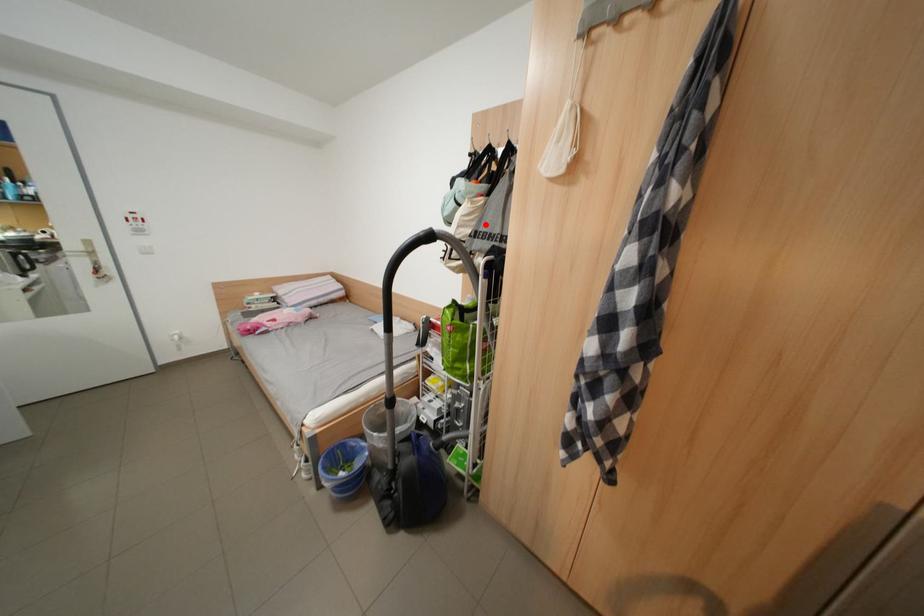
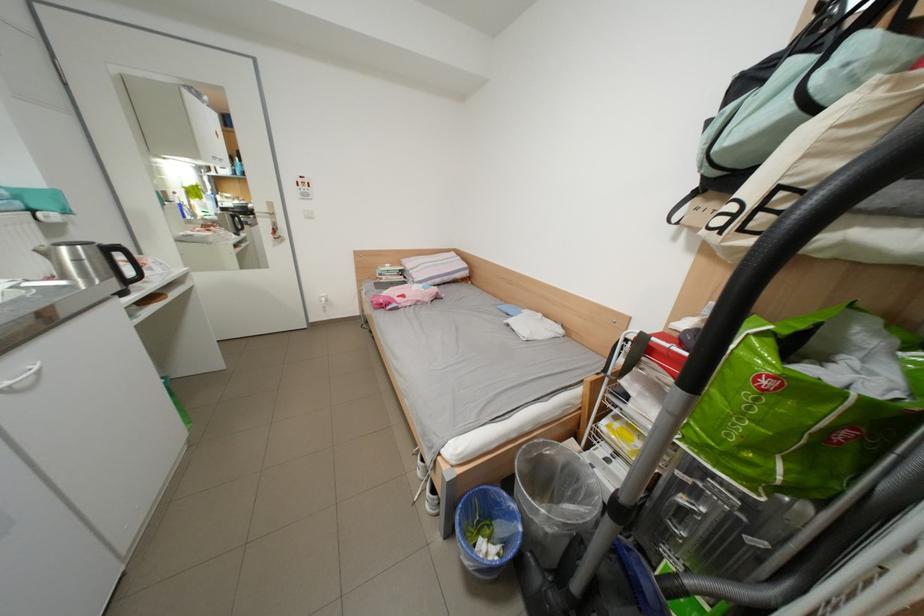
Find the pixel in the second image that matches the highlighted location in the first image.

(877, 146)